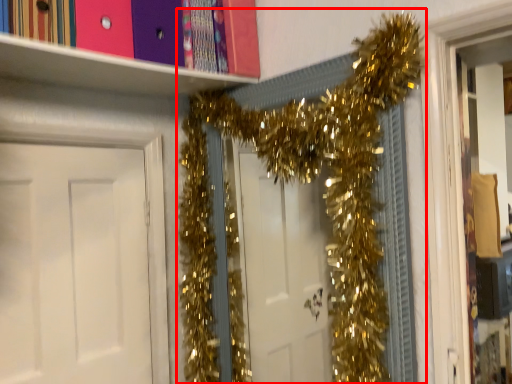
Question: From the image's perspective, where is christmas decoration (annotated by the red box) located relative to door?

Choices:
 (A) above
 (B) below

Answer: (A)